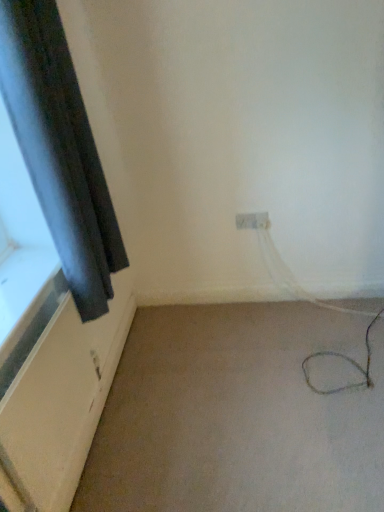
Question: Considering the positions of black matte curtain at left and beige carpet at lower right in the image, is black matte curtain at left bigger or smaller than beige carpet at lower right?

Choices:
 (A) big
 (B) small

Answer: (B)

Question: In terms of width, does black matte curtain at left look wider or thinner when compared to beige carpet at lower right?

Choices:
 (A) thin
 (B) wide

Answer: (A)

Question: Estimate the real-world distances between objects in this image. Which object is farther from the beige carpet at lower right?

Choices:
 (A) white plastic electric outlet at center
 (B) black matte curtain at left

Answer: (B)

Question: Estimate the real-world distances between objects in this image. Which object is closer to the white plastic electric outlet at center?

Choices:
 (A) beige carpet at lower right
 (B) black matte curtain at left

Answer: (A)